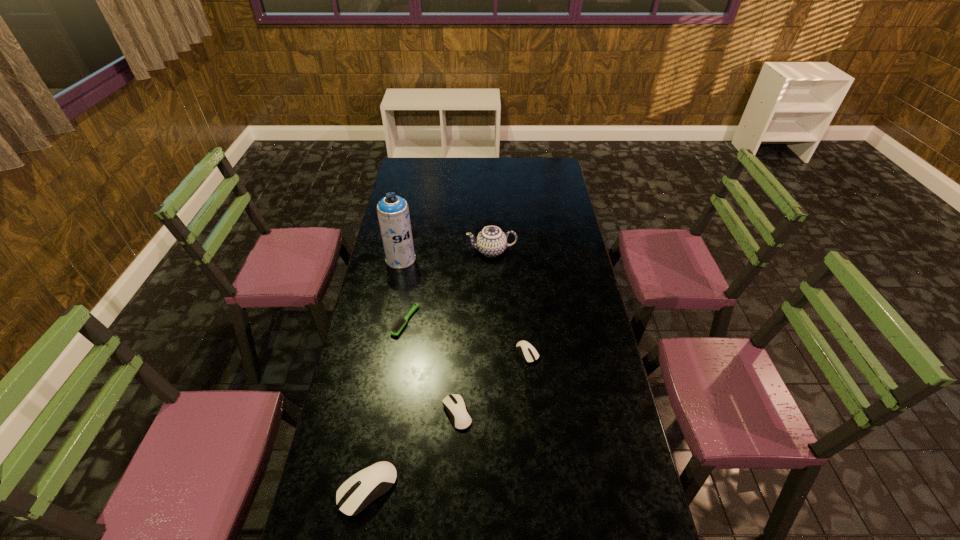
Please show where to add a mouse on the right while keeping spacing even. Please provide its 2D coordinates. Your answer should be formatted as a tuple, i.e. [(x, y)], where the tuple contains the x and y coordinates of a point satisfying the conditions above.

[(584, 304)]